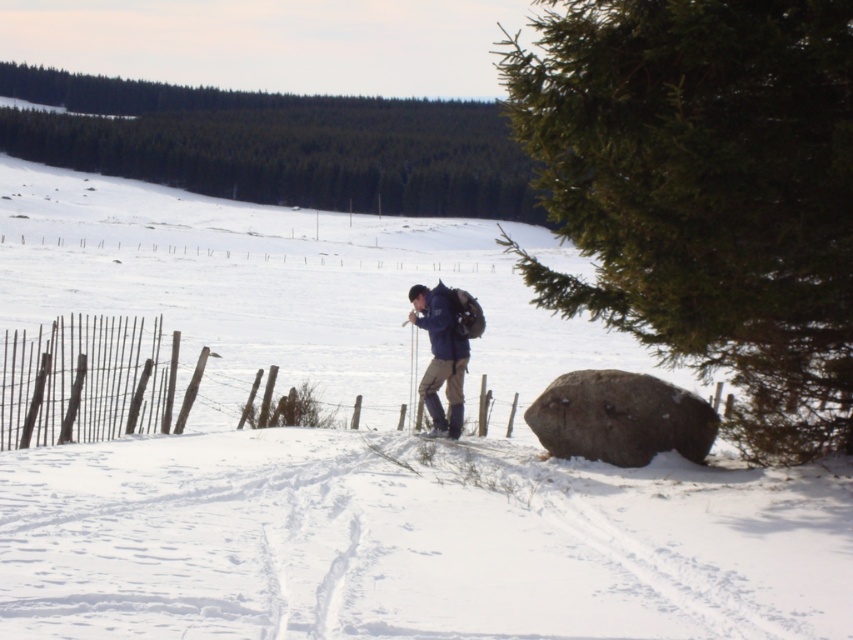
Which is more to the right, green textured rock at lower right or green matte tree at upper center?

green textured rock at lower right

Is point (683, 68) closer to camera compared to point (86, 81)?

Yes, point (683, 68) is closer to viewer.

The width and height of the screenshot is (853, 640). Describe the element at coordinates (704, 193) in the screenshot. I see `green textured rock at lower right` at that location.

I want to click on green textured rock at lower right, so click(704, 193).

Who is taller, green textured rock at lower right or brown rough boulder at lower right?

green textured rock at lower right is taller.

The image size is (853, 640). What do you see at coordinates (704, 193) in the screenshot?
I see `green textured rock at lower right` at bounding box center [704, 193].

Between point (780, 44) and point (631, 392), which one is positioned in front?

Point (780, 44)

Image resolution: width=853 pixels, height=640 pixels. Find the location of `green textured rock at lower right`. green textured rock at lower right is located at coordinates (704, 193).

Does green textured rock at lower right appear over rusty wire fence at left?

Yes, green textured rock at lower right is above rusty wire fence at left.

Between point (730, 282) and point (113, 353), which one is positioned behind?

Positioned behind is point (113, 353).

I want to click on green textured rock at lower right, so click(704, 193).